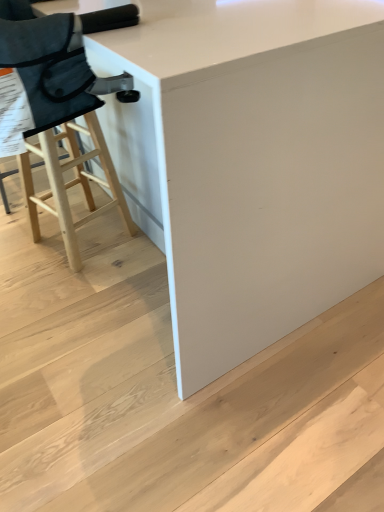
The width and height of the screenshot is (384, 512). Find the location of `free point to the left of natural wood stool at left`. free point to the left of natural wood stool at left is located at coordinates (13, 233).